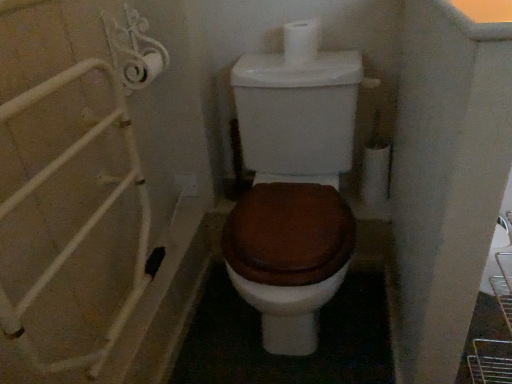
What do you see at coordinates (301, 41) in the screenshot?
I see `white matte toilet paper at upper center` at bounding box center [301, 41].

Locate an element on the screen. The image size is (512, 384). white matte toilet paper at upper center is located at coordinates (301, 41).

Locate an element on the screen. The width and height of the screenshot is (512, 384). brown matte toilet at center is located at coordinates (293, 191).

Looking at this image, in order to face brown matte toilet at center, should I rotate leftwards or rightwards?

Turn right approximately 4.561 degrees to face it.

The width and height of the screenshot is (512, 384). What do you see at coordinates (293, 191) in the screenshot?
I see `brown matte toilet at center` at bounding box center [293, 191].

Where is `white matte toilet paper at upper center`? The width and height of the screenshot is (512, 384). white matte toilet paper at upper center is located at coordinates (301, 41).

Considering the relative positions of white matte toilet paper at upper center and brown matte toilet at center in the image provided, is white matte toilet paper at upper center to the left or to the right of brown matte toilet at center?

From the image, it's evident that white matte toilet paper at upper center is to the right of brown matte toilet at center.

Does white matte toilet paper at upper center come behind brown matte toilet at center?

Yes, the depth of white matte toilet paper at upper center is greater than that of brown matte toilet at center.

Considering the positions of points (309, 19) and (298, 274), is point (309, 19) closer to camera compared to point (298, 274)?

No, it is behind (298, 274).

From the image's perspective, relative to brown matte toilet at center, is white matte toilet paper at upper center above or below?

white matte toilet paper at upper center is situated higher than brown matte toilet at center in the image.

In the scene shown: From a real-world perspective, does white matte toilet paper at upper center stand above brown matte toilet at center?

Yes.

Which of these two, white matte toilet paper at upper center or brown matte toilet at center, is wider?

brown matte toilet at center.

Does white matte toilet paper at upper center have a lesser height compared to brown matte toilet at center?

Yes, white matte toilet paper at upper center is shorter than brown matte toilet at center.

Consider the image. In terms of size, does white matte toilet paper at upper center appear bigger or smaller than brown matte toilet at center?

In the image, white matte toilet paper at upper center appears to be smaller than brown matte toilet at center.

Is brown matte toilet at center located within white matte toilet paper at upper center?

No, white matte toilet paper at upper center does not contain brown matte toilet at center.

Would you say white matte toilet paper at upper center is a long distance from brown matte toilet at center?

No.

Is white matte toilet paper at upper center facing away from brown matte toilet at center?

No.

The height and width of the screenshot is (384, 512). Identify the location of toilet paper behind the brown matte toilet at center. (301, 41).

Which is more to the left, brown matte toilet at center or white matte toilet paper at upper center?

Positioned to the left is brown matte toilet at center.

Is the position of brown matte toilet at center less distant than that of white matte toilet paper at upper center?

Yes.

Which point is more forward, (239, 204) or (302, 64)?

The point (239, 204) is more forward.

From the image's perspective, which one is positioned lower, brown matte toilet at center or white matte toilet paper at upper center?

brown matte toilet at center.

From a real-world perspective, does brown matte toilet at center sit lower than white matte toilet paper at upper center?

Yes, from a real-world perspective, brown matte toilet at center is below white matte toilet paper at upper center.

Considering the sizes of objects brown matte toilet at center and white matte toilet paper at upper center in the image provided, who is wider, brown matte toilet at center or white matte toilet paper at upper center?

With larger width is brown matte toilet at center.

Considering the sizes of objects brown matte toilet at center and white matte toilet paper at upper center in the image provided, who is taller, brown matte toilet at center or white matte toilet paper at upper center?

With more height is brown matte toilet at center.

Considering the relative sizes of brown matte toilet at center and white matte toilet paper at upper center in the image provided, is brown matte toilet at center bigger than white matte toilet paper at upper center?

Yes.

From the picture: Which is correct: brown matte toilet at center is inside white matte toilet paper at upper center, or outside of it?

brown matte toilet at center lies outside white matte toilet paper at upper center.

Does brown matte toilet at center touch white matte toilet paper at upper center?

There is a gap between brown matte toilet at center and white matte toilet paper at upper center.

Does brown matte toilet at center turn towards white matte toilet paper at upper center?

No, brown matte toilet at center is not aimed at white matte toilet paper at upper center.

What's the angular difference between brown matte toilet at center and white matte toilet paper at upper center's facing directions?

1.5 degrees.

Measure the distance between brown matte toilet at center and white matte toilet paper at upper center.

A distance of 13.86 inches exists between brown matte toilet at center and white matte toilet paper at upper center.

Find the location of `toilet below the white matte toilet paper at upper center (from a real-world perspective)`. toilet below the white matte toilet paper at upper center (from a real-world perspective) is located at coordinates click(x=293, y=191).

Find the location of a particular element. The height and width of the screenshot is (384, 512). toilet paper behind the brown matte toilet at center is located at coordinates (301, 41).

You are a GUI agent. You are given a task and a screenshot of the screen. Output one action in this format:
    pyautogui.click(x=<x>, y=<y>)
    Task: Click on the toilet on the left side of white matte toilet paper at upper center
    
    Given the screenshot: What is the action you would take?
    pyautogui.click(x=293, y=191)